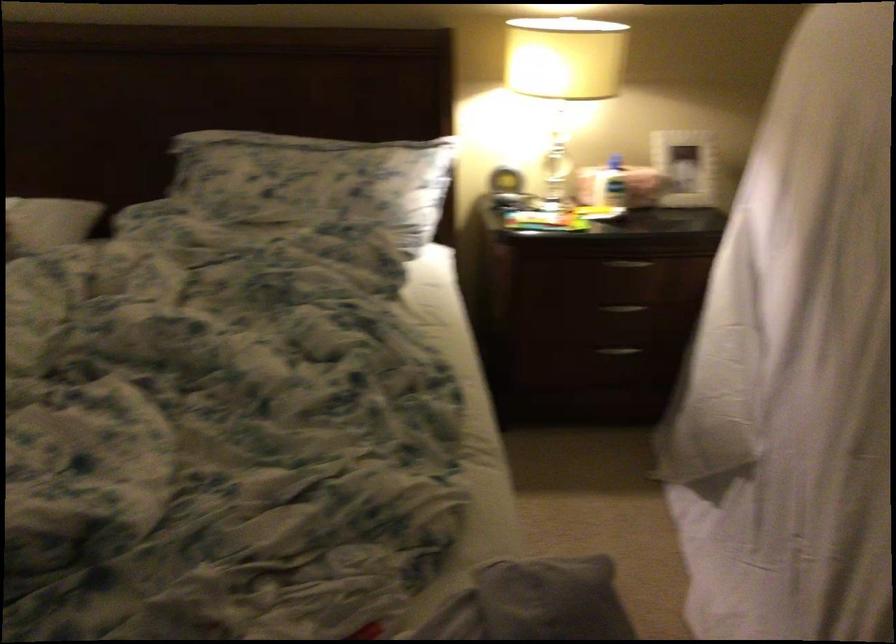
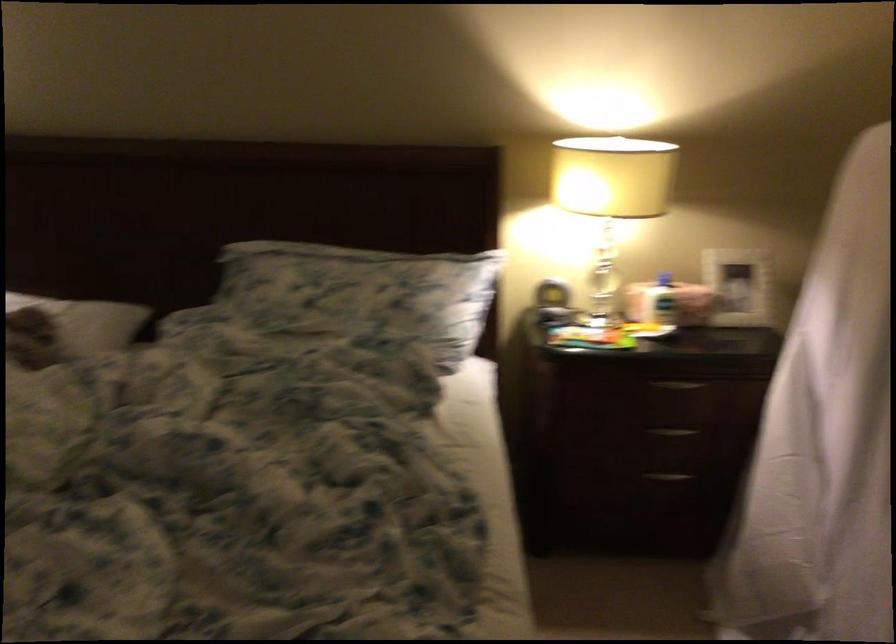
Find the pixel in the second image that matches (x=618, y=348) in the first image.

(668, 476)